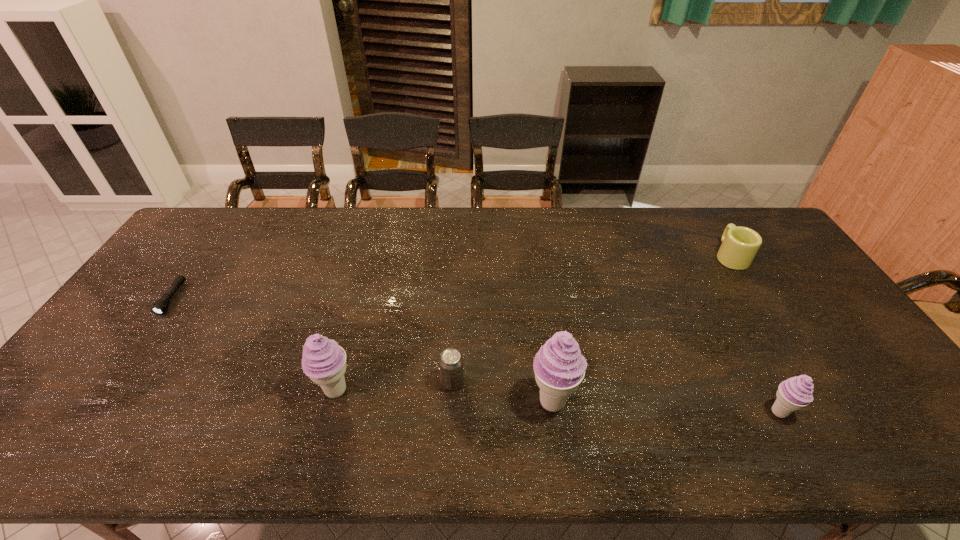
You are a GUI agent. You are given a task and a screenshot of the screen. Output one action in this format:
    pyautogui.click(x=<x>, y=<y>)
    Task: Click on the vacant space located 0.170m on the back of the fifth object from right to left
    The height and width of the screenshot is (540, 960).
    Given the screenshot: What is the action you would take?
    pyautogui.click(x=354, y=323)

Find the location of a particular element. The height and width of the screenshot is (540, 960). free space located on the left of the fourth object from left to right is located at coordinates (443, 401).

At what (x,y) coordinates should I click in order to perform the action: click on blank area located 0.290m on the back of the rightmost icecream. Please return your answer as a coordinate pair (x, y). The height and width of the screenshot is (540, 960). Looking at the image, I should click on pos(724,312).

This screenshot has height=540, width=960. What are the coordinates of `vacant space located with the handle on the side of the mug` in the screenshot? It's located at coord(707,219).

You are a GUI agent. You are given a task and a screenshot of the screen. Output one action in this format:
    pyautogui.click(x=<x>, y=<y>)
    Task: Click on the vacant space situated with the handle on the side of the mug
    
    Given the screenshot: What is the action you would take?
    pyautogui.click(x=705, y=215)

Identify the location of free space located 0.180m with the handle on the side of the mug. This screenshot has width=960, height=540. (703, 213).

Where is `vacant space located 0.170m on the right of the beer can`? The height and width of the screenshot is (540, 960). vacant space located 0.170m on the right of the beer can is located at coordinates (532, 382).

I want to click on vacant space located 0.300m at the lens end of the shortest object, so click(93, 409).

The height and width of the screenshot is (540, 960). I want to click on object that is positioned at the far edge, so click(x=740, y=245).

Locate an element on the screen. beer can present at the near edge is located at coordinates (451, 361).